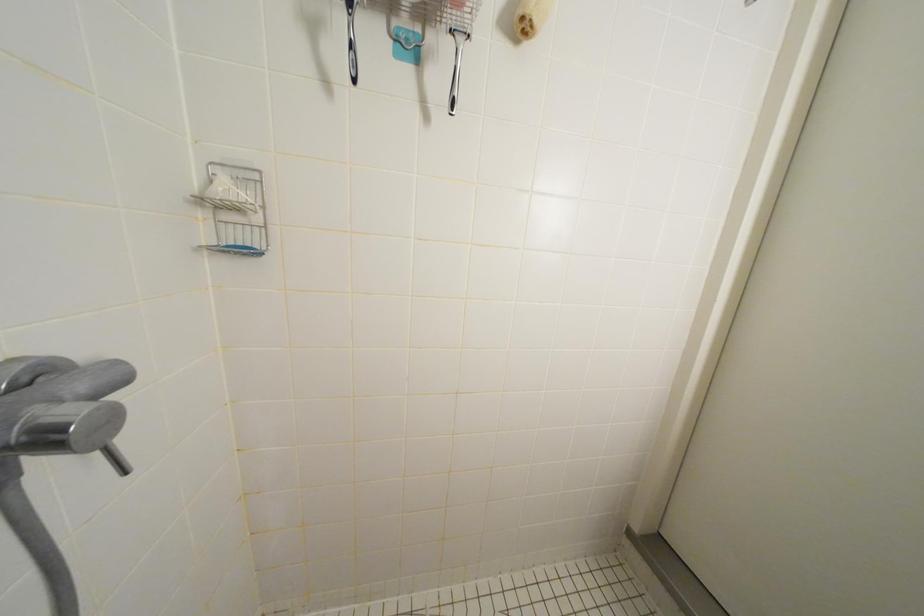
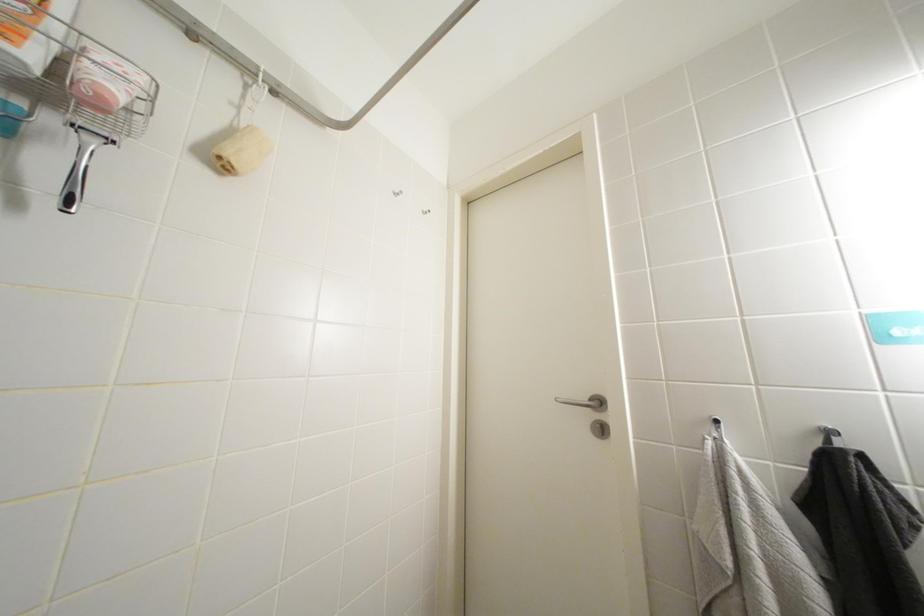
The images are taken continuously from a first-person perspective. In which direction is your viewpoint rotating?

The camera rotated toward right-up.